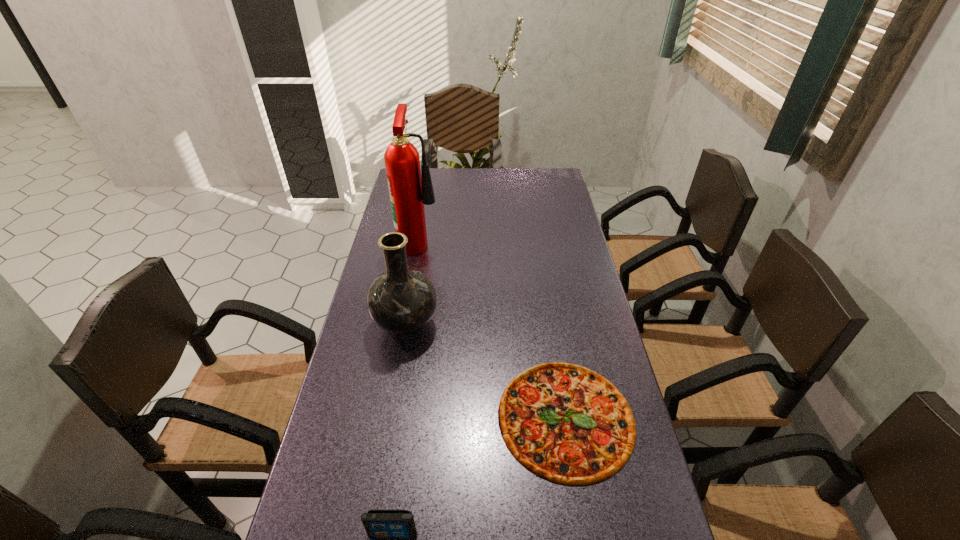
What are the coordinates of `the farthest object` in the screenshot? It's located at (410, 186).

Find the location of a particular element. This screenshot has height=540, width=960. fire extinguisher is located at coordinates (410, 186).

Find the location of a particular element. This screenshot has width=960, height=540. vase is located at coordinates coord(401,301).

At what (x,y) coordinates should I click in order to perform the action: click on the third nearest object. Please return your answer as a coordinate pair (x, y). Image resolution: width=960 pixels, height=540 pixels. Looking at the image, I should click on (401, 301).

Locate an element on the screen. This screenshot has height=540, width=960. iPod is located at coordinates (379, 524).

At what (x,y) coordinates should I click in order to perform the action: click on the third tallest object. Please return your answer as a coordinate pair (x, y). This screenshot has height=540, width=960. Looking at the image, I should click on (379, 524).

Identify the location of the second nearest object. (566, 423).

Where is `the rightmost object`? The image size is (960, 540). the rightmost object is located at coordinates (566, 423).

Find the location of a particular element. The width and height of the screenshot is (960, 540). vacant space located 0.230m at the nozzle of the farthest object is located at coordinates (503, 241).

Identify the location of vacant space located 0.350m on the front of the third shortest object. Image resolution: width=960 pixels, height=540 pixels. (379, 474).